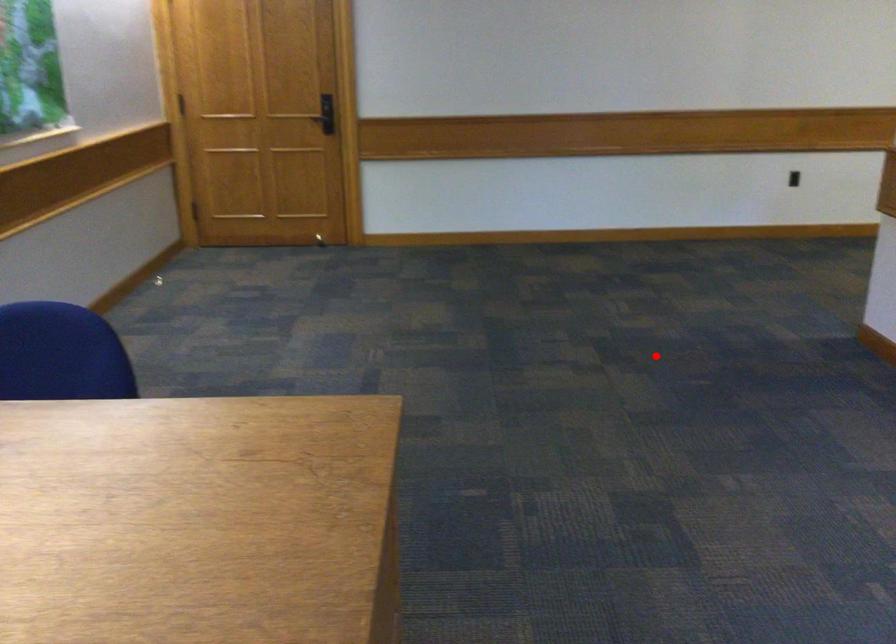
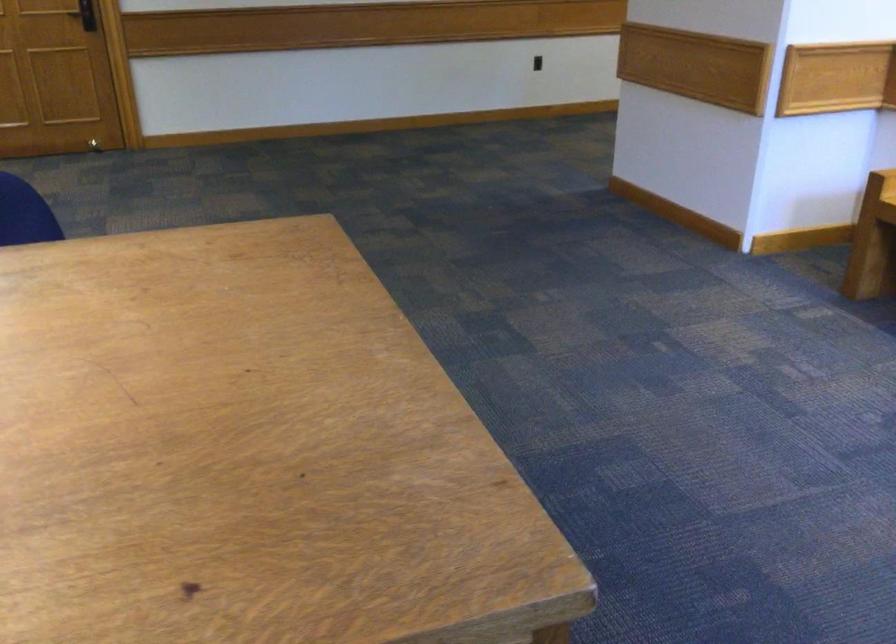
Question: I am providing you with two images of the same scene from different viewpoints. A red point is shown in image1. For the corresponding object point in image2, is it positioned nearer or farther from the camera?

Choices:
 (A) Nearer
 (B) Farther

Answer: (B)